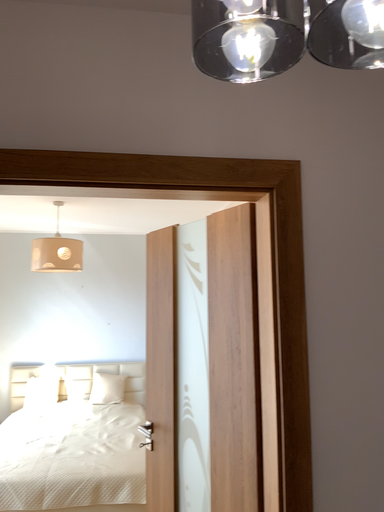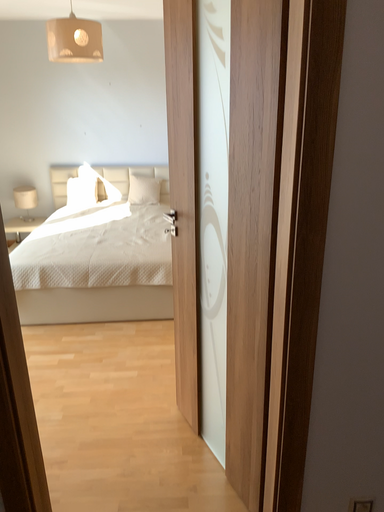
Question: Which way did the camera rotate in the video?

Choices:
 (A) rotated downward
 (B) rotated upward

Answer: (A)